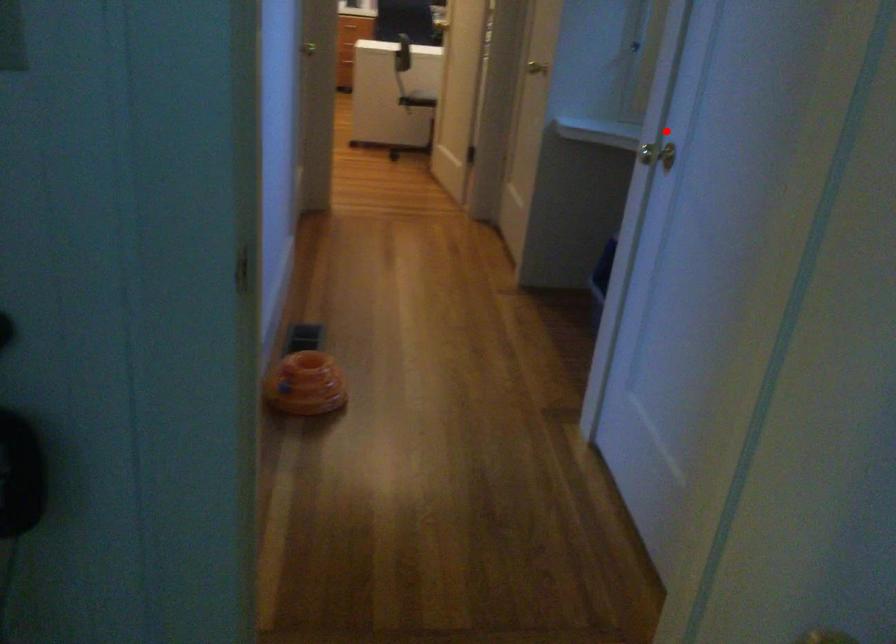
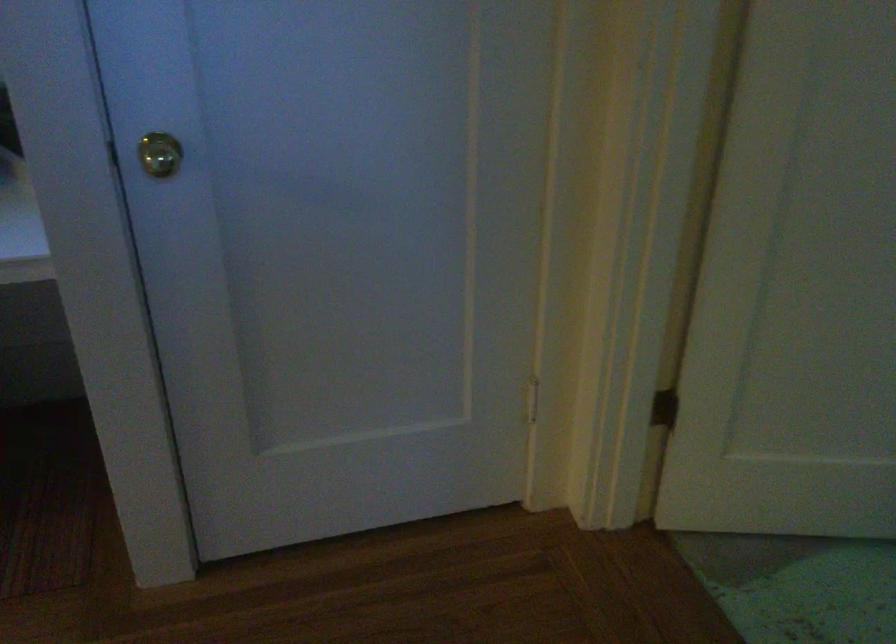
Where in the second image is the point corresponding to the highlighted location from the first image?

(159, 154)